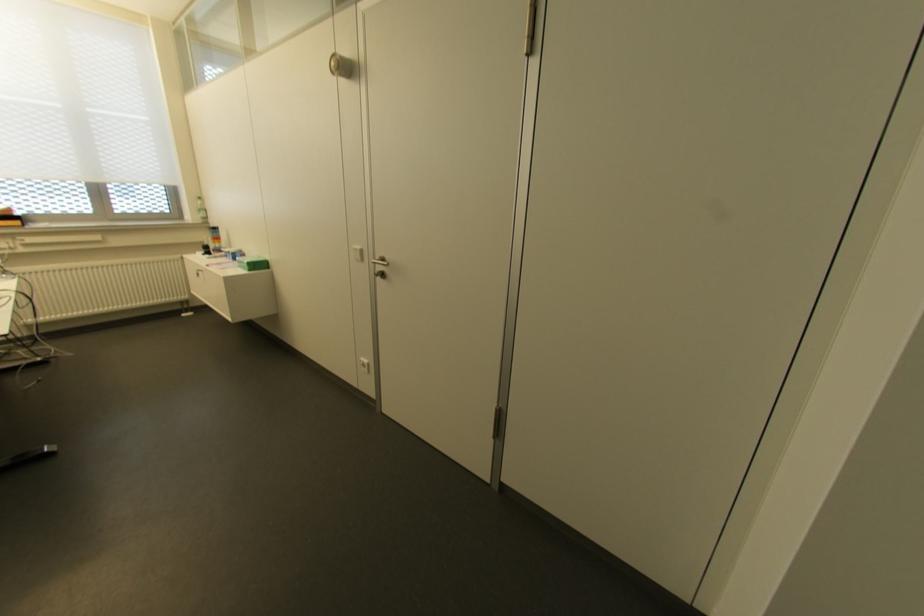
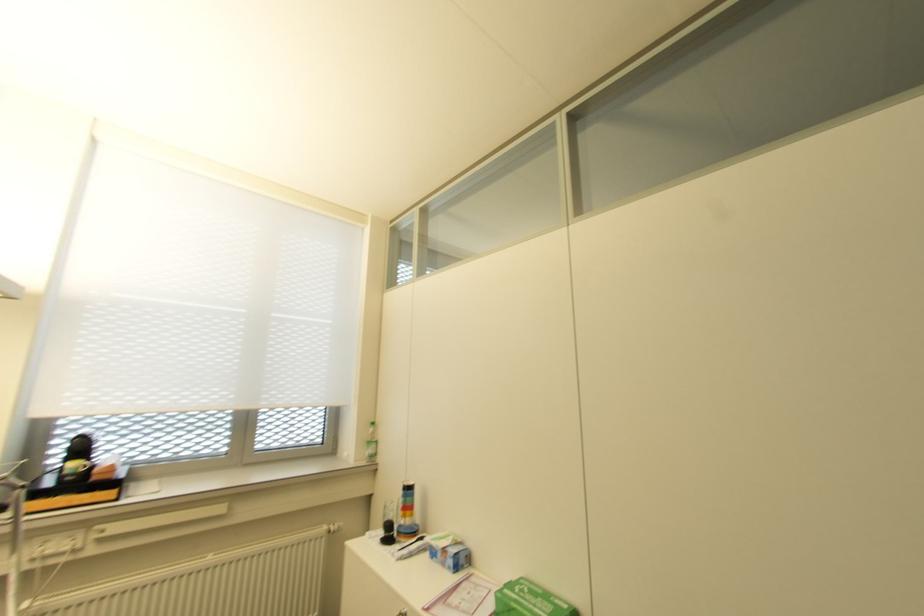
Find the pixel in the second image that matches [260,259] in the first image.

(563, 605)